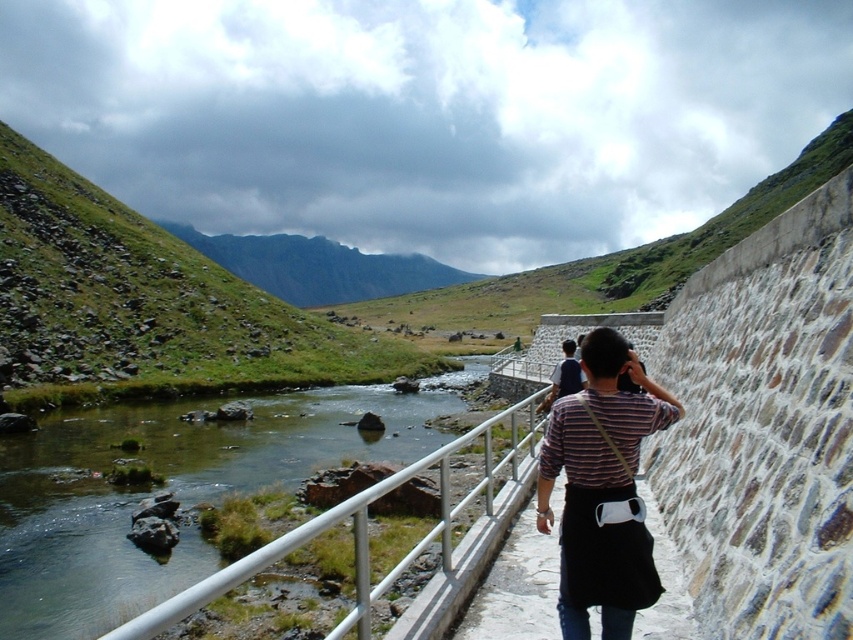
You are standing on the pathway and looking towards the railing. There are two points marked on the image, point 1 at coordinates point (598, 481) and point 2 at coordinates point (451, 451). Which point is closer to you?

Point (598, 481) is closer to the viewer than point (451, 451).

You are standing at the entrance of the pathway and see the striped fabric shirt at center. If you walk straight ahead, will you move towards the stone wall on the right or the metal railing on the left?

Since the striped fabric shirt at center is located at point coordinates of (602, 488), walking straight ahead along the pathway would lead you towards the metal railing on the left rather than the stone wall on the right.